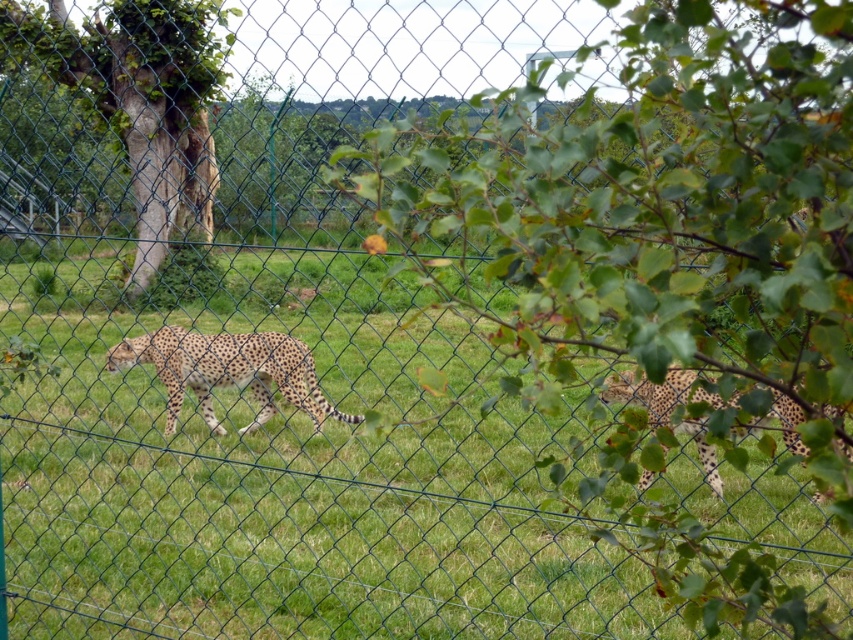
Question: Is green rough bark tree at left to the right of spotted fur cheetah at right from the viewer's perspective?

Choices:
 (A) yes
 (B) no

Answer: (B)

Question: Which point is farther to the camera?

Choices:
 (A) spotted fur cheetah at center
 (B) green rough bark tree at left

Answer: (B)

Question: Can you confirm if spotted fur cheetah at center is bigger than spotted fur cheetah at right?

Choices:
 (A) yes
 (B) no

Answer: (A)

Question: Which object is closer to the camera taking this photo?

Choices:
 (A) spotted fur cheetah at right
 (B) spotted fur cheetah at center

Answer: (A)

Question: Estimate the real-world distances between objects in this image. Which object is farther from the spotted fur cheetah at right?

Choices:
 (A) green rough bark tree at left
 (B) spotted fur cheetah at center

Answer: (A)

Question: Where is green rough bark tree at left located in relation to spotted fur cheetah at right in the image?

Choices:
 (A) right
 (B) left

Answer: (B)